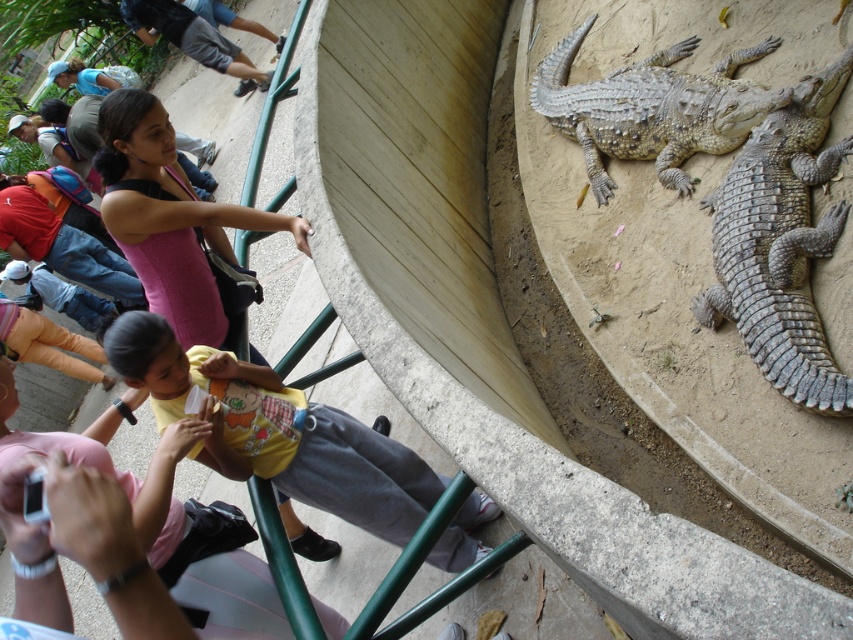
Question: Does gray textured crocodile at right have a lesser width compared to gray scaly crocodile at upper right?

Choices:
 (A) yes
 (B) no

Answer: (A)

Question: Which point is closer to the camera taking this photo?

Choices:
 (A) (695, 132)
 (B) (730, 173)

Answer: (B)

Question: Which point appears closest to the camera in this image?

Choices:
 (A) (265, 451)
 (B) (767, 216)
 (C) (718, 68)

Answer: (A)

Question: Is yellow cotton shirt at center bigger than gray scaly crocodile at upper right?

Choices:
 (A) no
 (B) yes

Answer: (A)

Question: Which object is positioned farthest from the gray textured crocodile at right?

Choices:
 (A) gray scaly crocodile at upper right
 (B) yellow cotton shirt at center

Answer: (B)

Question: Is gray textured crocodile at right positioned behind gray scaly crocodile at upper right?

Choices:
 (A) yes
 (B) no

Answer: (B)